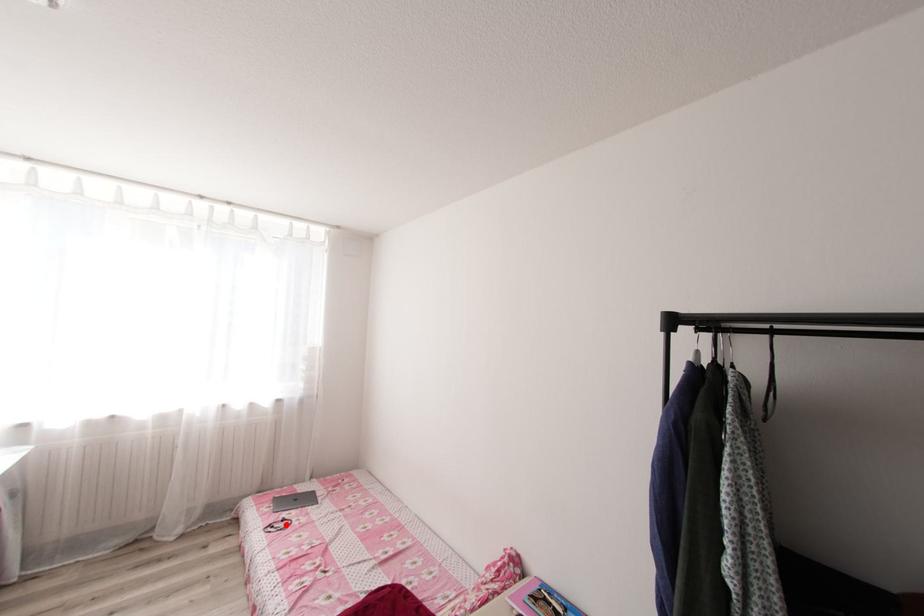
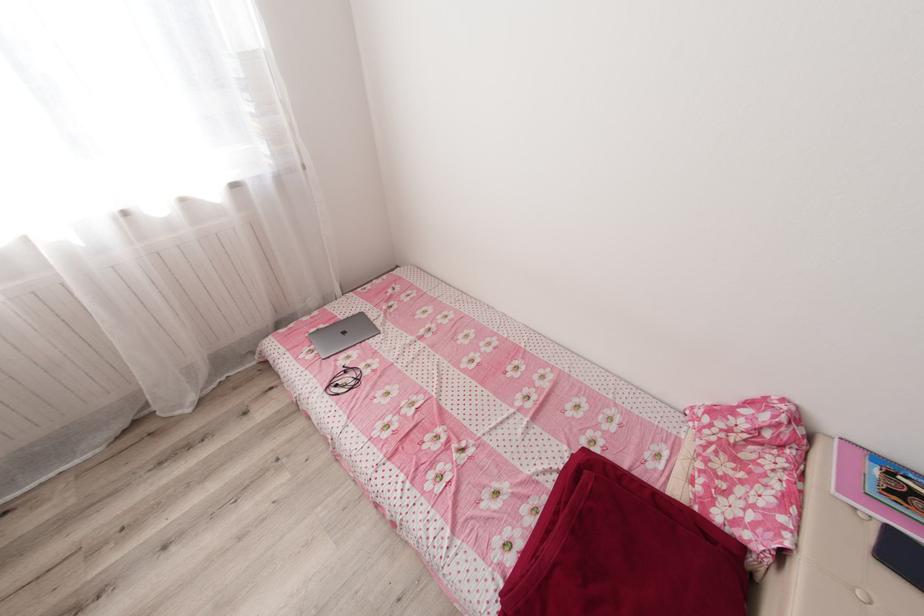
The point at the highlighted location is marked in the first image. Where is the corresponding point in the second image?

(353, 379)